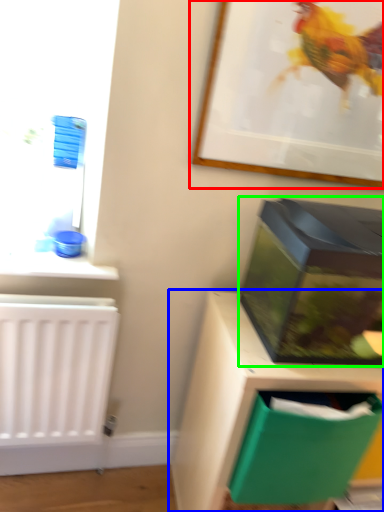
Question: Estimate the real-world distances between objects in this image. Which object is farther from picture frame (highlighted by a red box), furniture (highlighted by a blue box) or box (highlighted by a green box)?

Choices:
 (A) furniture
 (B) box

Answer: (A)